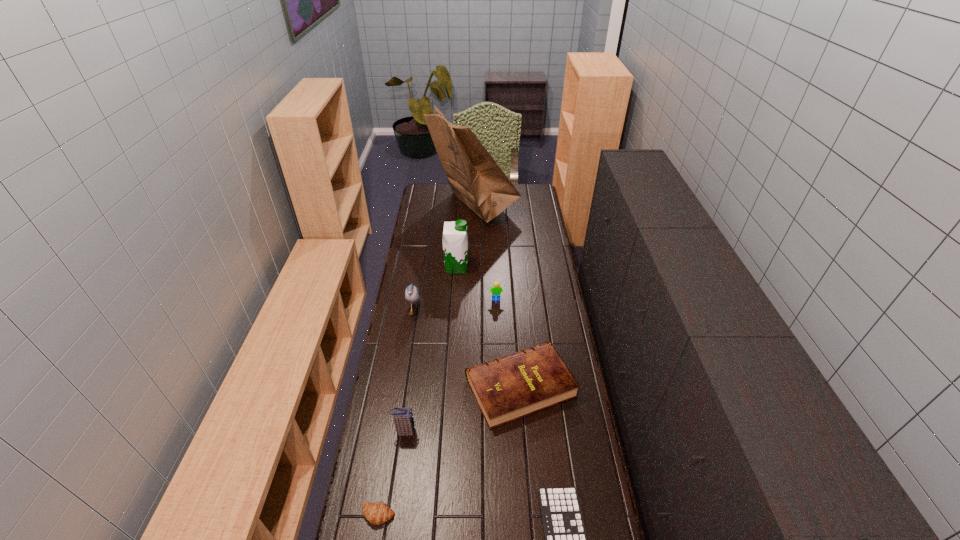
You are a GUI agent. You are given a task and a screenshot of the screen. Output one action in this format:
    pyautogui.click(x=<x>, y=<y>)
    Task: Click on the blank area located on the front-facing side of the second farthest object
    The height and width of the screenshot is (540, 960).
    Given the screenshot: What is the action you would take?
    pyautogui.click(x=494, y=267)

The width and height of the screenshot is (960, 540). Identify the location of vacant region located at the tip of the third tallest object's beak. pos(447,311).

Where is `free spot located 0.230m with the zip open on the fourth tallest object`? free spot located 0.230m with the zip open on the fourth tallest object is located at coordinates (484, 431).

Locate an element on the screen. free space located 0.160m on the face of the fourth shortest object is located at coordinates (497, 329).

You are a GUI agent. You are given a task and a screenshot of the screen. Output one action in this format:
    pyautogui.click(x=<x>, y=<y>)
    Task: Click on the vacant space located on the back of the hardback book
    
    Given the screenshot: What is the action you would take?
    (515, 316)

Image resolution: width=960 pixels, height=540 pixels. I want to click on vacant space located on the right of the second shortest object, so click(466, 515).

What are the coordinates of `object located in the far edge section of the desktop` in the screenshot? It's located at (475, 178).

Locate an element on the screen. The width and height of the screenshot is (960, 540). grocery bag present at the left edge is located at coordinates (475, 178).

Where is `bird present at the left edge`? This screenshot has height=540, width=960. bird present at the left edge is located at coordinates (412, 295).

Where is `clutch bag situated at the left edge`? clutch bag situated at the left edge is located at coordinates (403, 418).